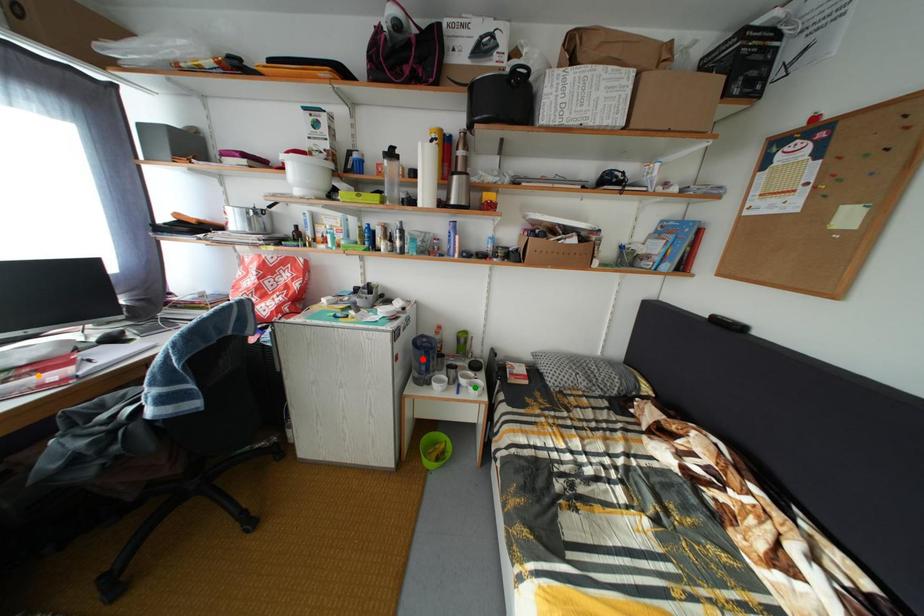
Order these from nearest to farthest:
green point
orange point
red point

green point < red point < orange point